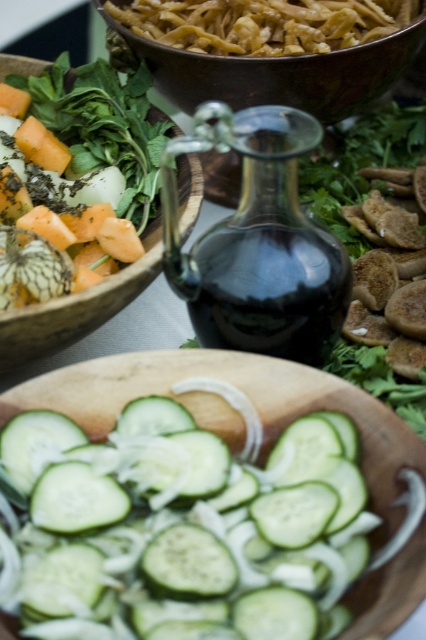
Is green smooth cucumber at center bigger than golden pasta at upper center?

Incorrect, green smooth cucumber at center is not larger than golden pasta at upper center.

Is green smooth cucumber at center further to the viewer compared to golden pasta at upper center?

No, green smooth cucumber at center is closer to the viewer.

This screenshot has height=640, width=426. Find the location of `green smooth cucumber at center`. green smooth cucumber at center is located at coordinates (180, 529).

Can you confirm if golden pasta at upper center is taller than wooden bowl at upper left?

Incorrect, golden pasta at upper center's height is not larger of wooden bowl at upper left's.

Which is below, golden pasta at upper center or wooden bowl at upper left?

wooden bowl at upper left is lower down.

Is point (152, 13) positioned in front of point (201, 180)?

No, (152, 13) is behind (201, 180).

Where is `golden pasta at upper center`? This screenshot has height=640, width=426. golden pasta at upper center is located at coordinates (264, 22).

Can you confirm if matte brown bowl at upper center is positioned to the left of wooden bowl at upper left?

Incorrect, matte brown bowl at upper center is not on the left side of wooden bowl at upper left.

Can you confirm if matte brown bowl at upper center is positioned below wooden bowl at upper left?

Actually, matte brown bowl at upper center is above wooden bowl at upper left.

Between point (180, 84) and point (69, 70), which one is positioned in front?

Point (180, 84) is more forward.

Identify the location of matte brown bowl at upper center. (279, 74).